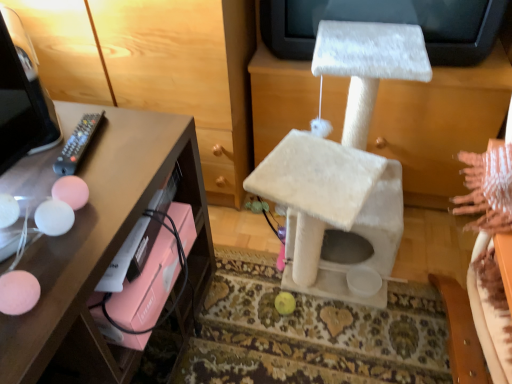
Where is `matte pink drawer at left`? matte pink drawer at left is located at coordinates coord(188,75).

You are a GUI agent. You are given a task and a screenshot of the screen. Output one action in this format:
    pyautogui.click(x=<x>, y=<y>)
    Task: Click on the black plastic remote at left
    The height and width of the screenshot is (384, 512).
    Given the screenshot: What is the action you would take?
    pyautogui.click(x=77, y=144)

Considering the relative sizes of white furry cat tree at center and black plastic remote at left in the image provided, is white furry cat tree at center wider than black plastic remote at left?

Yes, white furry cat tree at center is wider than black plastic remote at left.

There is a white furry cat tree at center. In order to click on remote above it (from a real-world perspective) in this screenshot , I will do `click(77, 144)`.

In the image, is white furry cat tree at center on the left side or the right side of black plastic remote at left?

Based on their positions, white furry cat tree at center is located to the right of black plastic remote at left.

Does point (347, 150) lie in front of point (97, 127)?

No, (347, 150) is behind (97, 127).

Which is closer, [100,99] or [65,157]?

The point [65,157] is more forward.

Would you say matte pink drawer at left is inside or outside black plastic remote at left?

matte pink drawer at left is located beyond the bounds of black plastic remote at left.

From a real-world perspective, is matte pink drawer at left physically above black plastic remote at left?

No, from a real-world perspective, matte pink drawer at left is not over black plastic remote at left

Does matte pink drawer at left have a greater width compared to black plastic remote at left?

Indeed, matte pink drawer at left has a greater width compared to black plastic remote at left.

In the scene shown: Is matte pink drawer at left in front of or behind white furry cat tree at center in the image?

Clearly, matte pink drawer at left is behind white furry cat tree at center.

Would you say matte pink drawer at left is a long distance from white furry cat tree at center?

No, matte pink drawer at left is in close proximity to white furry cat tree at center.

Can you confirm if matte pink drawer at left is thinner than white furry cat tree at center?

Indeed, matte pink drawer at left has a lesser width compared to white furry cat tree at center.

Is matte pink drawer at left bigger than white furry cat tree at center?

Yes, matte pink drawer at left is bigger than white furry cat tree at center.

Looking at the image, does white furry cat tree at center seem bigger or smaller compared to matte pink drawer at left?

white furry cat tree at center is smaller than matte pink drawer at left.

This screenshot has width=512, height=384. In order to click on furniture above the white furry cat tree at center (from the image's perspective) in this screenshot , I will do `click(188, 75)`.

Is white furry cat tree at center next to matte pink drawer at left and touching it?

No.

You are a GUI agent. You are given a task and a screenshot of the screen. Output one action in this format:
    pyautogui.click(x=<x>, y=<y>)
    Task: Click on the furniture above the black plastic remote at left (from the image's perspective)
    Image resolution: width=512 pixels, height=384 pixels.
    Given the screenshot: What is the action you would take?
    pyautogui.click(x=188, y=75)

Looking at their sizes, would you say black plastic remote at left is wider or thinner than matte pink drawer at left?

Clearly, black plastic remote at left has less width compared to matte pink drawer at left.

Considering the relative positions of black plastic remote at left and matte pink drawer at left in the image provided, is black plastic remote at left to the right of matte pink drawer at left from the viewer's perspective?

Indeed, black plastic remote at left is positioned on the right side of matte pink drawer at left.

Is black plastic remote at left smaller than matte pink drawer at left?

Correct, black plastic remote at left occupies less space than matte pink drawer at left.

Is point (72, 150) positioned in front of point (307, 174)?

Yes.

Is black plastic remote at left positioned far away from white furry cat tree at center?

No, black plastic remote at left is not far from white furry cat tree at center.

Can you confirm if black plastic remote at left is shorter than white furry cat tree at center?

Indeed, black plastic remote at left has a lesser height compared to white furry cat tree at center.

You are a GUI agent. You are given a task and a screenshot of the screen. Output one action in this format:
    pyautogui.click(x=<x>, y=<y>)
    Task: Click on the swivel chair on the right of black plastic remote at left
    
    Given the screenshot: What is the action you would take?
    pyautogui.click(x=344, y=163)

Identify the location of furniture located behind the black plastic remote at left. (188, 75).

When comparing their distances from matte pink drawer at left, does white furry cat tree at center or black plastic remote at left seem closer?

Among the two, white furry cat tree at center is located nearer to matte pink drawer at left.

From the image, which object appears to be nearer to black plastic remote at left, matte pink drawer at left or white furry cat tree at center?

matte pink drawer at left is positioned closer to the anchor black plastic remote at left.

Based on their spatial positions, is black plastic remote at left or matte pink drawer at left closer to white furry cat tree at center?

matte pink drawer at left is positioned closer to the anchor white furry cat tree at center.

When comparing their distances from black plastic remote at left, does white furry cat tree at center or matte pink drawer at left seem closer?

Among the two, matte pink drawer at left is located nearer to black plastic remote at left.

When comparing their distances from white furry cat tree at center, does matte pink drawer at left or black plastic remote at left seem closer?

matte pink drawer at left lies closer to white furry cat tree at center than the other object.

Looking at the image, which one is located further to matte pink drawer at left, black plastic remote at left or white furry cat tree at center?

black plastic remote at left lies further to matte pink drawer at left than the other object.

At what (x,y) coordinates should I click in order to perform the action: click on remote between matte pink drawer at left and white furry cat tree at center. Please return your answer as a coordinate pair (x, y). Looking at the image, I should click on (77, 144).